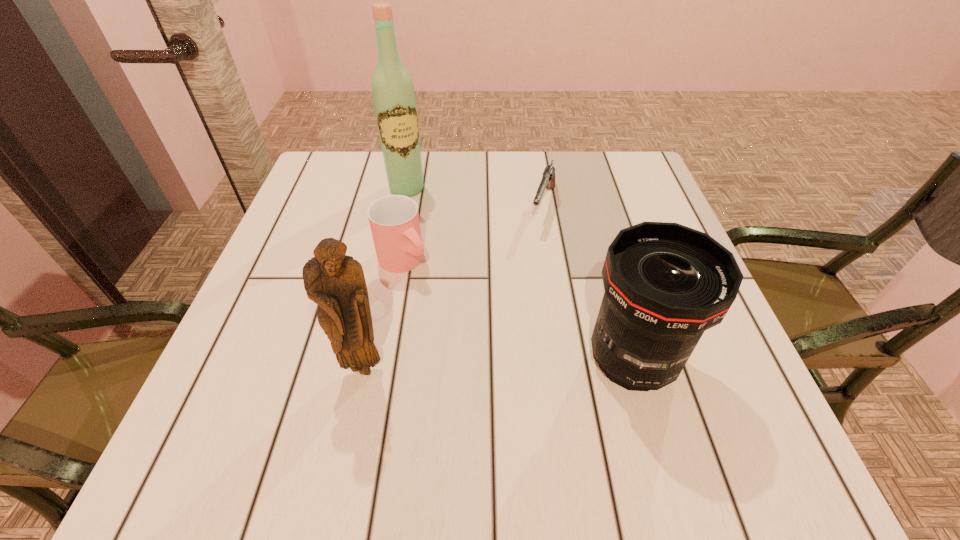
The image size is (960, 540). Find the location of `vacant spot on the desktop that is between the figurine and the telephoto lens and is positioned on the front-facing side of the wine bottle`. vacant spot on the desktop that is between the figurine and the telephoto lens and is positioned on the front-facing side of the wine bottle is located at coordinates point(481,365).

The image size is (960, 540). What are the coordinates of `vacant space on the desktop that is between the figurine and the telephoto lens and is positioned on the side of the fourth tallest object with the handle` in the screenshot? It's located at [x=505, y=364].

The width and height of the screenshot is (960, 540). Identify the location of free spot on the desktop that is between the fourth shortest object and the third tallest object and is positioned aiming along the barrel of the shortest object. click(483, 365).